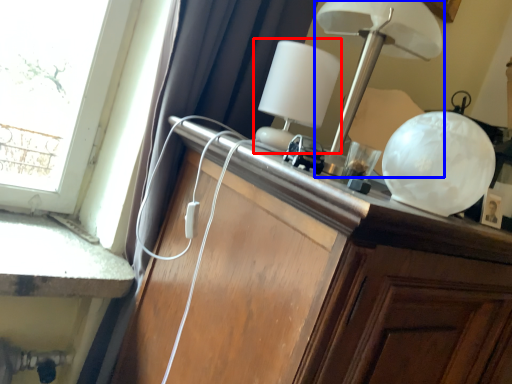
Question: Which point is further to the camera, table lamp (highlighted by a red box) or lamp (highlighted by a blue box)?

Choices:
 (A) table lamp
 (B) lamp

Answer: (A)